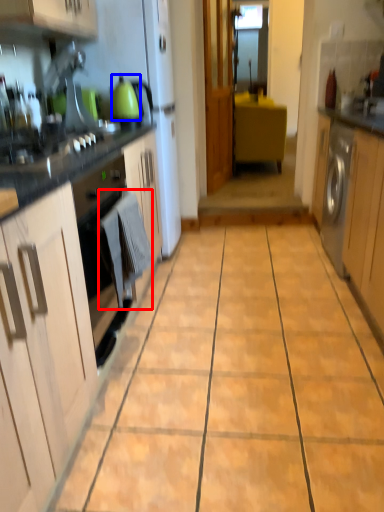
Question: Which object appears farthest to the camera in this image, laundry (highlighted by a red box) or kitchen appliance (highlighted by a blue box)?

Choices:
 (A) laundry
 (B) kitchen appliance

Answer: (B)